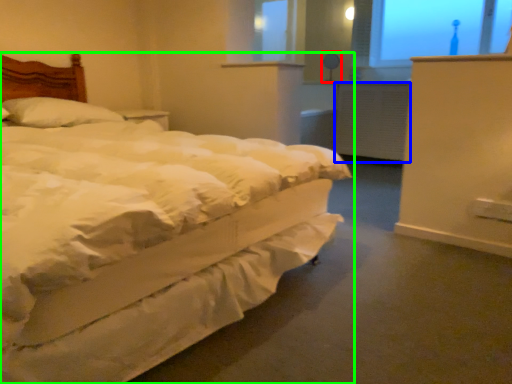
Question: Considering the real-world distances, which object is farthest from table lamp (highlighted by a red box)? radiator (highlighted by a blue box) or bed (highlighted by a green box)?

Choices:
 (A) radiator
 (B) bed

Answer: (B)